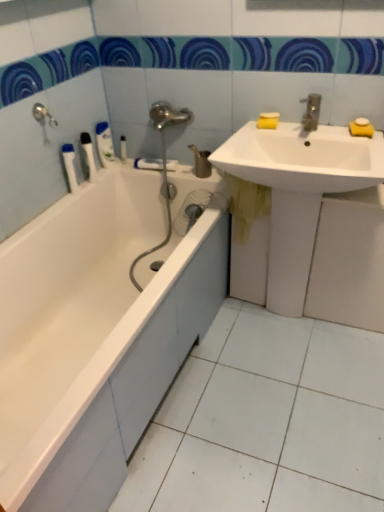
What are the coordinates of `vacant space positioned to the left of yellow sponge at upper right, marked as the second soap in a right-to-left arrangement` in the screenshot? It's located at (327, 131).